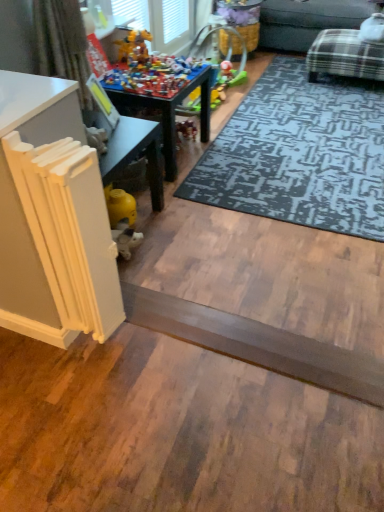
Question: Are wooden toy table at center, arranged as the first table when viewed from the top, and multicolored plastic toys at center making contact?

Choices:
 (A) no
 (B) yes

Answer: (A)

Question: Can you confirm if wooden toy table at center, which is the second table from front to back, is smaller than multicolored plastic toys at center?

Choices:
 (A) yes
 (B) no

Answer: (B)

Question: From a real-world perspective, is wooden toy table at center, the first table from the back, over multicolored plastic toys at center?

Choices:
 (A) yes
 (B) no

Answer: (B)

Question: Can you confirm if wooden toy table at center, which is the second table from front to back, is shorter than multicolored plastic toys at center?

Choices:
 (A) yes
 (B) no

Answer: (B)

Question: Considering the relative sizes of wooden toy table at center, arranged as the first table when viewed from the top, and multicolored plastic toys at center in the image provided, is wooden toy table at center, arranged as the first table when viewed from the top, taller than multicolored plastic toys at center?

Choices:
 (A) no
 (B) yes

Answer: (B)

Question: In terms of width, does wooden toy table at center, which is the second table from front to back, look wider or thinner when compared to white painted wood table at lower left, which ranks as the 2th table in top-to-bottom order?

Choices:
 (A) wide
 (B) thin

Answer: (A)

Question: In terms of height, does wooden toy table at center, arranged as the second table when ordered from the bottom, look taller or shorter compared to white painted wood table at lower left, which ranks as the 2th table in top-to-bottom order?

Choices:
 (A) tall
 (B) short

Answer: (B)

Question: In the image, is wooden toy table at center, which is the second table from front to back, positioned in front of or behind white painted wood table at lower left, arranged as the first table when ordered from the bottom?

Choices:
 (A) behind
 (B) front

Answer: (A)

Question: From a real-world perspective, is wooden toy table at center, the first table from the back, physically located above or below white painted wood table at lower left, which ranks as the 2th table in top-to-bottom order?

Choices:
 (A) below
 (B) above

Answer: (A)

Question: Is plaid fabric couch at upper right wider or thinner than white painted wood table at lower left, marked as the 1th table in a front-to-back arrangement?

Choices:
 (A) wide
 (B) thin

Answer: (A)

Question: Is plaid fabric couch at upper right in front of or behind white painted wood table at lower left, which ranks as the 2th table in top-to-bottom order, in the image?

Choices:
 (A) front
 (B) behind

Answer: (B)

Question: From a real-world perspective, relative to white painted wood table at lower left, arranged as the first table when ordered from the bottom, is plaid fabric couch at upper right vertically above or below?

Choices:
 (A) below
 (B) above

Answer: (A)

Question: Is plaid fabric couch at upper right situated inside white painted wood table at lower left, which ranks as the 2th table in top-to-bottom order, or outside?

Choices:
 (A) outside
 (B) inside

Answer: (A)

Question: From a real-world perspective, relative to dark gray textured rug at center, is smooth gray plank at center vertically above or below?

Choices:
 (A) below
 (B) above

Answer: (B)

Question: Is smooth gray plank at center to the left or to the right of dark gray textured rug at center in the image?

Choices:
 (A) right
 (B) left

Answer: (B)